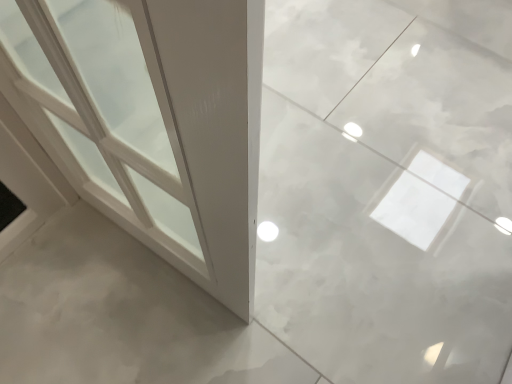
Find the location of `vacant space situated above white polished concrete at center (from a real-world perspective)`. vacant space situated above white polished concrete at center (from a real-world perspective) is located at coordinates (81, 300).